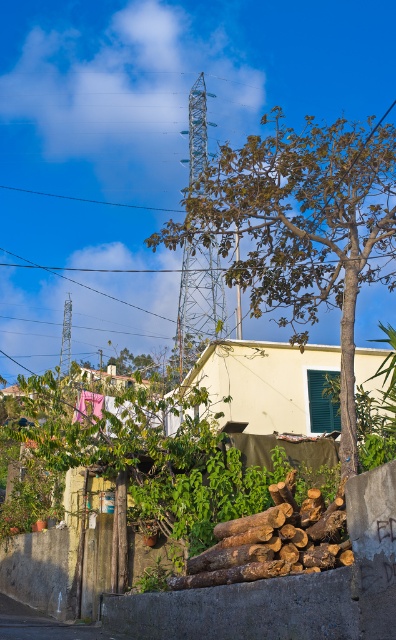
Question: Which object is closer to the camera taking this photo?

Choices:
 (A) brown leafy tree at center
 (B) natural brown wood at center

Answer: (B)

Question: Which of the following is the farthest from the observer?

Choices:
 (A) (224, 525)
 (B) (234, 211)

Answer: (B)

Question: Is brown leafy tree at center wider than natural brown wood at center?

Choices:
 (A) no
 (B) yes

Answer: (B)

Question: Does brown leafy tree at center appear on the left side of natural brown wood at center?

Choices:
 (A) yes
 (B) no

Answer: (B)

Question: Is brown leafy tree at center bigger than natural brown wood at center?

Choices:
 (A) yes
 (B) no

Answer: (A)